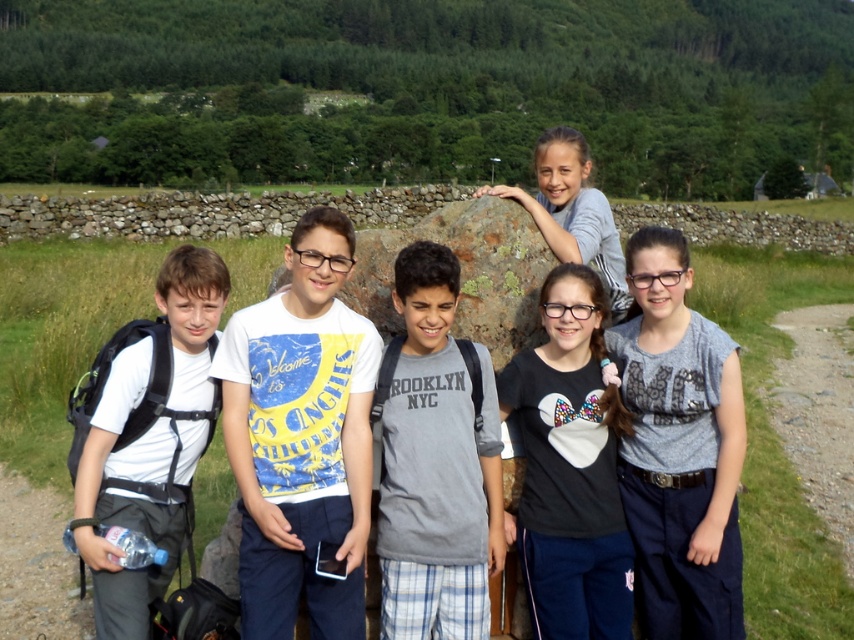
Question: In this image, where is gray cotton shirt at center located relative to green mossy rock at center?

Choices:
 (A) right
 (B) left

Answer: (A)

Question: Among these objects, which one is nearest to the camera?

Choices:
 (A) yellow printed t-shirt at center
 (B) gray cotton shirt at center
 (C) white matte backpack at left
 (D) gray cotton t-shirt at center

Answer: (A)

Question: Does gray cotton shirt at center appear on the left side of gray cotton t-shirt at center?

Choices:
 (A) no
 (B) yes

Answer: (A)

Question: Which of the following is the farthest from the observer?

Choices:
 (A) gray fabric at upper center
 (B) yellow printed t-shirt at center

Answer: (A)

Question: Is yellow printed t-shirt at center bigger than gray cotton shirt at center?

Choices:
 (A) yes
 (B) no

Answer: (B)

Question: Which of the following is the closest to the observer?

Choices:
 (A) (472, 467)
 (B) (170, 433)
 (C) (518, 284)
 (D) (196, 221)

Answer: (A)